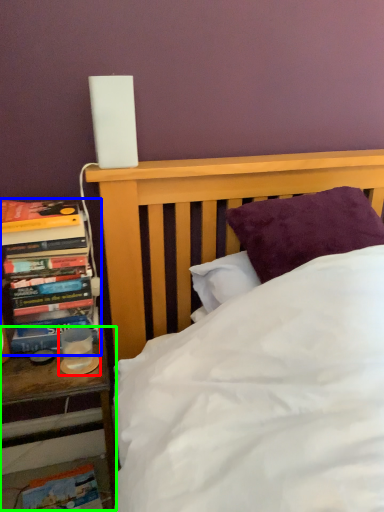
Question: Which object is the farthest from candle holder (highlighted by a red box)? Choose among these: book (highlighted by a blue box) or nightstand (highlighted by a green box).

Choices:
 (A) book
 (B) nightstand

Answer: (A)